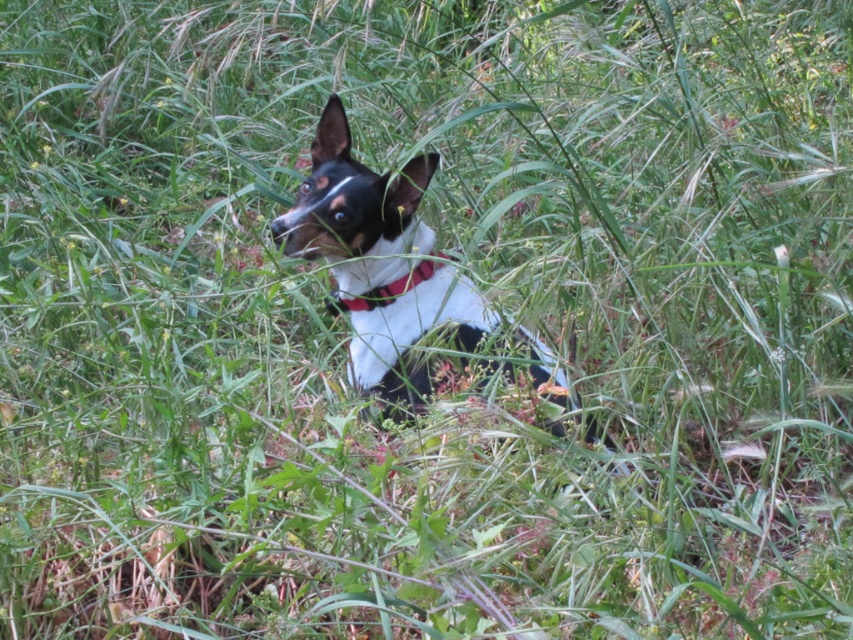
Based on the photo, you are a photographer trying to capture the black and white fur at center and the red fabric collar at center in a closeup shot. Which object will appear wider in the photo?

The black and white fur at center will appear wider in the photo since its width is larger than the red fabric collar at center.

You are a photographer trying to capture the black and white fur at center and the red fabric collar at center in a single frame. Given that your camera has a limited focus range, which object should you focus on to ensure both are in focus?

The black and white fur at center is bigger than red fabric collar at center, so focusing on the black and white fur at center will ensure both are within the focus range.

You are a photographer trying to capture the black and white fur at center and the red fabric collar at center in a single shot. Which object should you focus on first to ensure both are in frame?

The black and white fur at center is positioned under the red fabric collar at center, so you should focus on the red fabric collar at center first to ensure both are in frame.